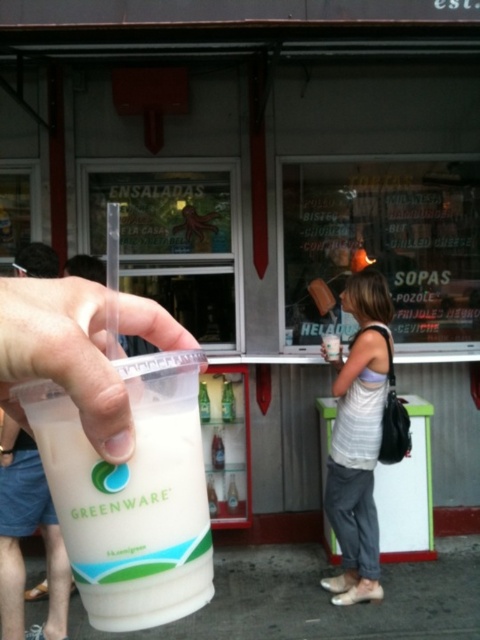
Question: Which of the following is the closest to the observer?

Choices:
 (A) white translucent plastic cup at center-left
 (B) white matte cup at center
 (C) translucent plastic cup at center
 (D) white striped tank top at center

Answer: (A)

Question: In this image, where is white translucent plastic cup at center-left located relative to translucent plastic cup at center?

Choices:
 (A) above
 (B) below

Answer: (A)

Question: Is white matte cup at center further to camera compared to white translucent plastic cup at center-left?

Choices:
 (A) no
 (B) yes

Answer: (B)

Question: Does white translucent plastic cup at center-left come in front of translucent plastic cup at center?

Choices:
 (A) yes
 (B) no

Answer: (A)

Question: Which point is closer to the camera taking this photo?

Choices:
 (A) (203, 390)
 (B) (332, 388)
 (C) (235, 410)
 (D) (188, 586)

Answer: (D)

Question: Which object appears closest to the camera in this image?

Choices:
 (A) white striped tank top at center
 (B) white translucent plastic cup at center-left
 (C) white matte cup at center
 (D) translucent plastic cup at center

Answer: (B)